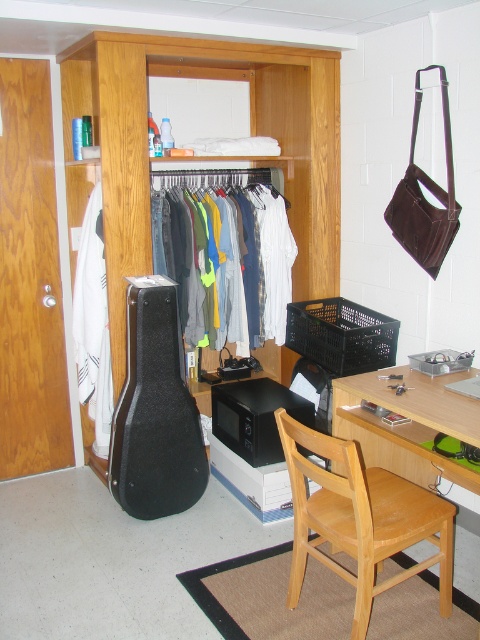
Can you confirm if black matte guitar case at lower left is positioned to the right of denim jeans at center?

Incorrect, black matte guitar case at lower left is not on the right side of denim jeans at center.

Is point (139, 134) in front of point (201, 179)?

Yes, point (139, 134) is closer to viewer.

Where is `black matte guitar case at lower left`? black matte guitar case at lower left is located at coordinates (251, 157).

Can you confirm if black hard case guitar at lower left is positioned below wooden desk at lower right?

No.

Does black hard case guitar at lower left lie behind wooden desk at lower right?

Yes.

I want to click on black hard case guitar at lower left, so click(x=155, y=412).

Identify the location of black hard case guitar at lower left. (155, 412).

Looking at this image, does black matte guitar case at lower left have a smaller size compared to wooden desk at lower right?

No, black matte guitar case at lower left is not smaller than wooden desk at lower right.

Between black matte guitar case at lower left and wooden desk at lower right, which one has more height?

black matte guitar case at lower left

Which is in front, point (326, 64) or point (415, 420)?

Point (415, 420) is in front.

Locate an element on the screen. black matte guitar case at lower left is located at coordinates (251, 157).